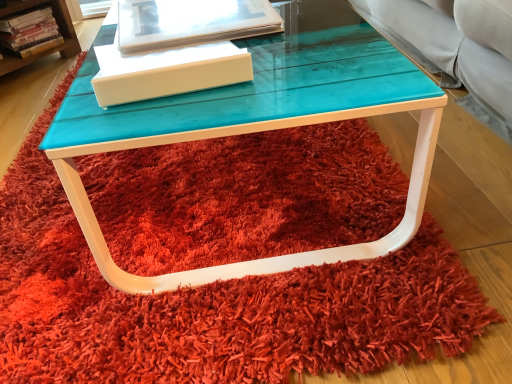
This screenshot has width=512, height=384. I want to click on translucent plastic book at upper center, the second book viewed from the top, so click(x=189, y=22).

Describe the element at coordinates (30, 32) in the screenshot. Image resolution: width=512 pixels, height=384 pixels. I see `hardcover book at left, which appears as the first book when viewed from the left` at that location.

Image resolution: width=512 pixels, height=384 pixels. What do you see at coordinates (254, 132) in the screenshot?
I see `turquoise glossy table at center` at bounding box center [254, 132].

What do you see at coordinates (167, 72) in the screenshot? I see `white matte box at center` at bounding box center [167, 72].

The height and width of the screenshot is (384, 512). I want to click on translucent plastic book at upper center, acting as the second book starting from the back, so click(189, 22).

Is turquoise glossy table at center spatially inside white matte box at center, or outside of it?

turquoise glossy table at center is spatially situated outside white matte box at center.

From the image's perspective, relative to white matte box at center, is turquoise glossy table at center above or below?

turquoise glossy table at center is situated higher than white matte box at center in the image.

How much distance is there between turquoise glossy table at center and white matte box at center?

A distance of 5.09 inches exists between turquoise glossy table at center and white matte box at center.

Looking at this image, is turquoise glossy table at center directly adjacent to white matte box at center?

No.

From a real-world perspective, is hardcover book at left, the second book positioned from the bottom, physically above translucent plastic book at upper center, the first book from the bottom?

Incorrect, from a real-world perspective, hardcover book at left, the second book positioned from the bottom, is lower than translucent plastic book at upper center, the first book from the bottom.

Can you confirm if hardcover book at left, positioned as the first book in back-to-front order, is taller than translucent plastic book at upper center, the second book viewed from the top?

Yes.

Is hardcover book at left, which appears as the first book when viewed from the left, inside the boundaries of translucent plastic book at upper center, the first book from the bottom, or outside?

hardcover book at left, which appears as the first book when viewed from the left, is outside translucent plastic book at upper center, the first book from the bottom.

Is translucent plastic book at upper center, the first book from the bottom, at the back of hardcover book at left, placed as the 1th book when sorted from top to bottom?

hardcover book at left, placed as the 1th book when sorted from top to bottom, is not turned away from translucent plastic book at upper center, the first book from the bottom.

From the image's perspective, is white matte box at center located beneath hardcover book at left, the 2th book when ordered from right to left?

Yes.

From the picture: Can you confirm if white matte box at center is thinner than hardcover book at left, positioned as the first book in back-to-front order?

In fact, white matte box at center might be wider than hardcover book at left, positioned as the first book in back-to-front order.

From a real-world perspective, which is physically above, white matte box at center or hardcover book at left, the second book positioned from the bottom?

From a 3D spatial view, white matte box at center is above.

Is white matte box at center shorter than hardcover book at left, positioned as the first book in back-to-front order?

Yes.

Do you think translucent plastic book at upper center, the second book viewed from the top, is within turquoise glossy table at center, or outside of it?

translucent plastic book at upper center, the second book viewed from the top, is spatially situated outside turquoise glossy table at center.

Looking at this image, between translucent plastic book at upper center, placed as the first book when sorted from front to back, and turquoise glossy table at center, which one has less height?

With less height is turquoise glossy table at center.

Is point (182, 25) closer to viewer compared to point (416, 172)?

No.

Can you tell me how much translucent plastic book at upper center, placed as the first book when sorted from front to back, and turquoise glossy table at center differ in facing direction?

The angular difference between translucent plastic book at upper center, placed as the first book when sorted from front to back, and turquoise glossy table at center is 98 degrees.

From the image's perspective, is white matte box at center on turquoise glossy table at center?

No, from the image's perspective, white matte box at center is not over turquoise glossy table at center.

Which is closer to the camera, (x=181, y=91) or (x=386, y=88)?

The point (x=386, y=88) is in front.

Considering the positions of objects white matte box at center and turquoise glossy table at center in the image provided, who is behind, white matte box at center or turquoise glossy table at center?

Positioned behind is white matte box at center.

Between hardcover book at left, the second book positioned from the bottom, and turquoise glossy table at center, which one has larger width?

With larger width is turquoise glossy table at center.

From the image's perspective, between hardcover book at left, which appears as the first book when viewed from the left, and turquoise glossy table at center, which one is located above?

hardcover book at left, which appears as the first book when viewed from the left, is shown above in the image.

From a real-world perspective, who is located lower, hardcover book at left, placed as the 1th book when sorted from top to bottom, or turquoise glossy table at center?

turquoise glossy table at center, from a real-world perspective.

Considering the relative positions of hardcover book at left, which appears as the second book when viewed from the front, and turquoise glossy table at center in the image provided, is hardcover book at left, which appears as the second book when viewed from the front, to the right of turquoise glossy table at center from the viewer's perspective?

No.

From the image's perspective, is translucent plastic book at upper center, placed as the first book when sorted from front to back, located above hardcover book at left, which appears as the second book when viewed from the front?

No, from the image's perspective, translucent plastic book at upper center, placed as the first book when sorted from front to back, is not above hardcover book at left, which appears as the second book when viewed from the front.

Based on the photo, is the surface of translucent plastic book at upper center, arranged as the 1th book when viewed from the right, in direct contact with hardcover book at left, the 2th book when ordered from right to left?

There is a gap between translucent plastic book at upper center, arranged as the 1th book when viewed from the right, and hardcover book at left, the 2th book when ordered from right to left.

Is point (149, 41) positioned in front of point (28, 33)?

Yes, it is in front of point (28, 33).

Looking at this image, considering the sizes of translucent plastic book at upper center, which appears as the 2th book when viewed from the left, and hardcover book at left, the second book positioned from the bottom, in the image, is translucent plastic book at upper center, which appears as the 2th book when viewed from the left, taller or shorter than hardcover book at left, the second book positioned from the bottom,?

In the image, translucent plastic book at upper center, which appears as the 2th book when viewed from the left, appears to be shorter than hardcover book at left, the second book positioned from the bottom.

In order to click on box that appears below the turquoise glossy table at center (from the image's perspective) in this screenshot , I will do `click(167, 72)`.

I want to click on book to the left of translucent plastic book at upper center, which appears as the 2th book when viewed from the left, so click(x=30, y=32).

Based on the photo, looking at the image, which one is located closer to turquoise glossy table at center, white matte box at center or translucent plastic book at upper center, the second book viewed from the top?

white matte box at center is positioned closer to the anchor turquoise glossy table at center.

Estimate the real-world distances between objects in this image. Which object is further from translucent plastic book at upper center, placed as the first book when sorted from front to back, white matte box at center or hardcover book at left, positioned as the first book in back-to-front order?

Among the two, hardcover book at left, positioned as the first book in back-to-front order, is located further to translucent plastic book at upper center, placed as the first book when sorted from front to back.

Which object lies nearer to the anchor point white matte box at center, translucent plastic book at upper center, acting as the second book starting from the back, or hardcover book at left, the second book positioned from the bottom?

The object closer to white matte box at center is translucent plastic book at upper center, acting as the second book starting from the back.

Considering their positions, is translucent plastic book at upper center, which appears as the 2th book when viewed from the left, positioned further to turquoise glossy table at center than hardcover book at left, which appears as the first book when viewed from the left?

hardcover book at left, which appears as the first book when viewed from the left, is positioned further to the anchor turquoise glossy table at center.

Looking at the image, which one is located closer to translucent plastic book at upper center, the second book viewed from the top, white matte box at center or turquoise glossy table at center?

white matte box at center.

Considering their positions, is turquoise glossy table at center positioned closer to translucent plastic book at upper center, which appears as the 2th book when viewed from the left, than white matte box at center?

white matte box at center.

From the image, which object appears to be farther from hardcover book at left, positioned as the first book in back-to-front order, white matte box at center or translucent plastic book at upper center, arranged as the 1th book when viewed from the right?

white matte box at center lies further to hardcover book at left, positioned as the first book in back-to-front order, than the other object.

Which object lies nearer to the anchor point hardcover book at left, the second book positioned from the bottom, white matte box at center or turquoise glossy table at center?

white matte box at center.

Locate an element on the screen. book positioned between white matte box at center and hardcover book at left, the 2th book when ordered from right to left, from near to far is located at coordinates (189, 22).

The width and height of the screenshot is (512, 384). In order to click on box between turquoise glossy table at center and hardcover book at left, placed as the 1th book when sorted from top to bottom, from front to back in this screenshot , I will do `click(167, 72)`.

You are a GUI agent. You are given a task and a screenshot of the screen. Output one action in this format:
    pyautogui.click(x=<x>, y=<y>)
    Task: Click on the book between turquoise glossy table at center and hardcover book at left, the second book positioned from the bottom, from front to back
    Image resolution: width=512 pixels, height=384 pixels.
    Given the screenshot: What is the action you would take?
    pyautogui.click(x=189, y=22)

The height and width of the screenshot is (384, 512). Find the location of `box positioned between turquoise glossy table at center and translucent plastic book at upper center, placed as the first book when sorted from front to back, from near to far`. box positioned between turquoise glossy table at center and translucent plastic book at upper center, placed as the first book when sorted from front to back, from near to far is located at coordinates (167, 72).